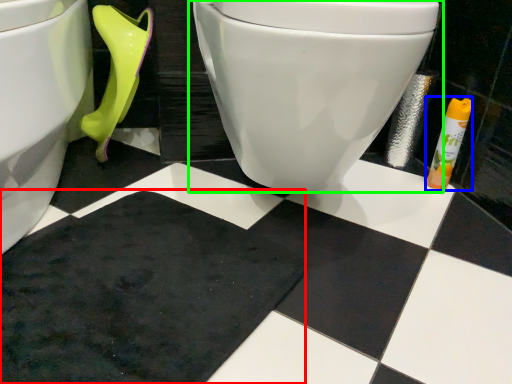
Question: Which object is the farthest from bath mat (highlighted by a red box)? Choose among these: toiletry (highlighted by a blue box) or toilet (highlighted by a green box).

Choices:
 (A) toiletry
 (B) toilet

Answer: (A)